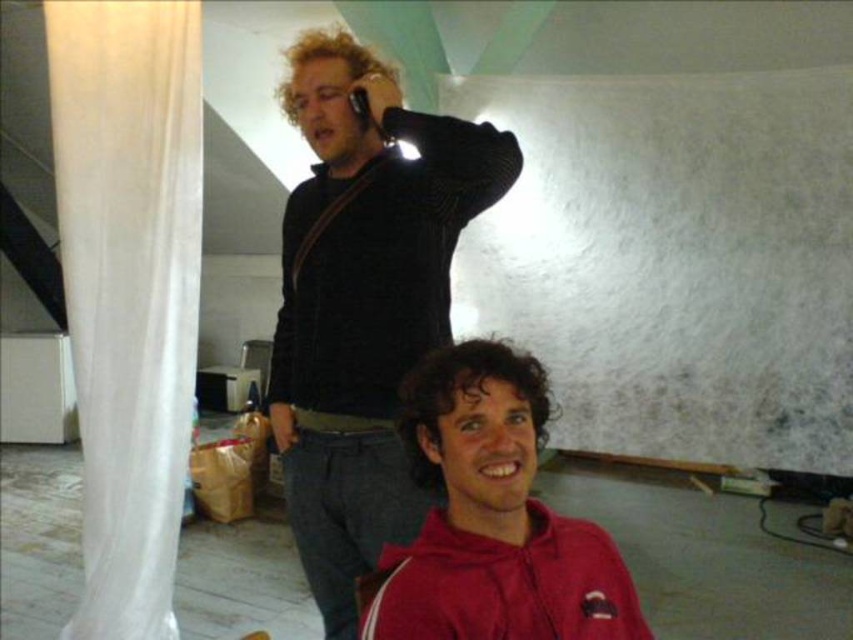
Question: Which object appears closest to the camera in this image?

Choices:
 (A) black sweater at upper center
 (B) white sheer curtain at left
 (C) red matte jacket at center

Answer: (C)

Question: Which object is farther from the camera taking this photo?

Choices:
 (A) white sheer curtain at left
 (B) red matte jacket at center
 (C) black sweater at upper center

Answer: (A)

Question: Is white sheer curtain at left below red matte jacket at center?

Choices:
 (A) yes
 (B) no

Answer: (B)

Question: Is black sweater at upper center further to camera compared to red matte jacket at center?

Choices:
 (A) no
 (B) yes

Answer: (B)

Question: Can you confirm if black sweater at upper center is wider than red matte jacket at center?

Choices:
 (A) no
 (B) yes

Answer: (B)

Question: Which point is farther to the camera?

Choices:
 (A) red matte jacket at center
 (B) white sheer curtain at left
 (C) black sweater at upper center

Answer: (B)